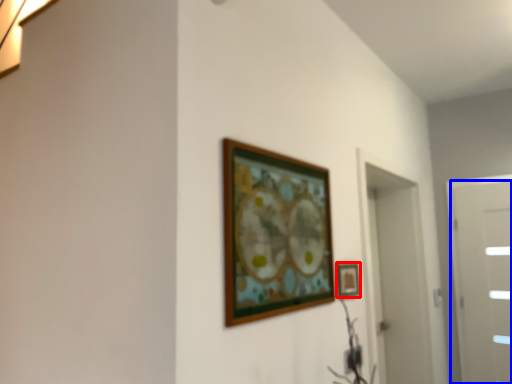
Question: Among these objects, which one is nearest to the camera, picture frame (highlighted by a red box) or door (highlighted by a blue box)?

Choices:
 (A) picture frame
 (B) door

Answer: (A)